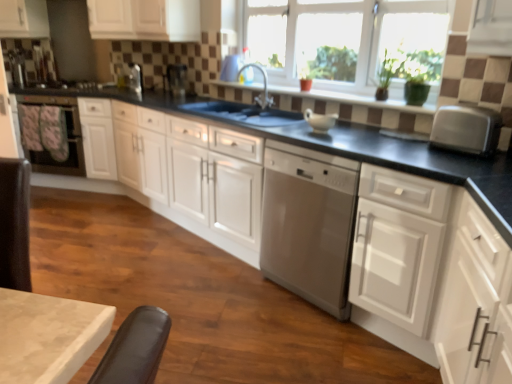
Image resolution: width=512 pixels, height=384 pixels. I want to click on free space in front of metallic silver toaster at upper center, arranged as the 1th appliance when viewed from the right, so click(176, 100).